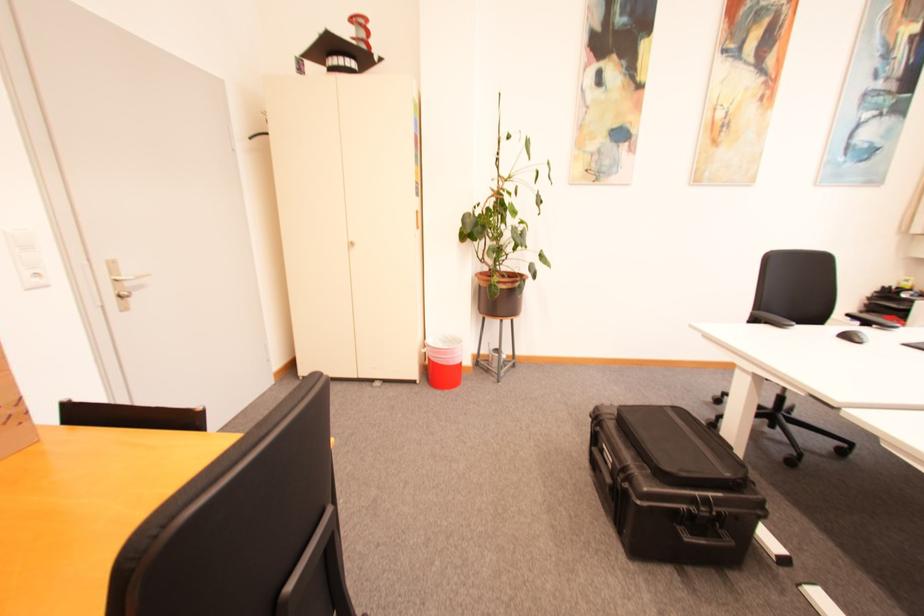
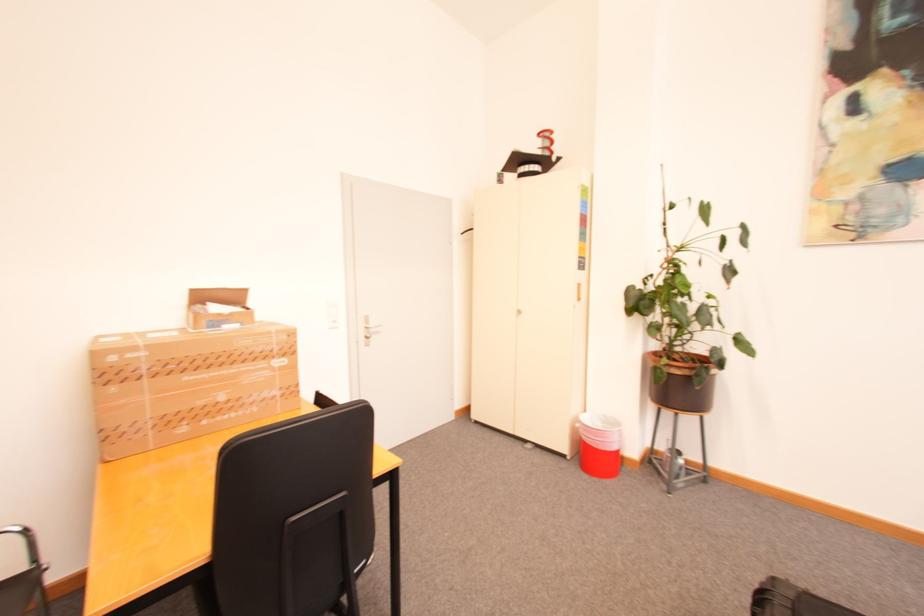
Question: The camera is either moving clockwise (left) or counter-clockwise (right) around the object. The first image is from the beginning of the video and the second image is from the end. Is the camera moving left or right when shooting the video?

Choices:
 (A) Left
 (B) Right

Answer: (B)